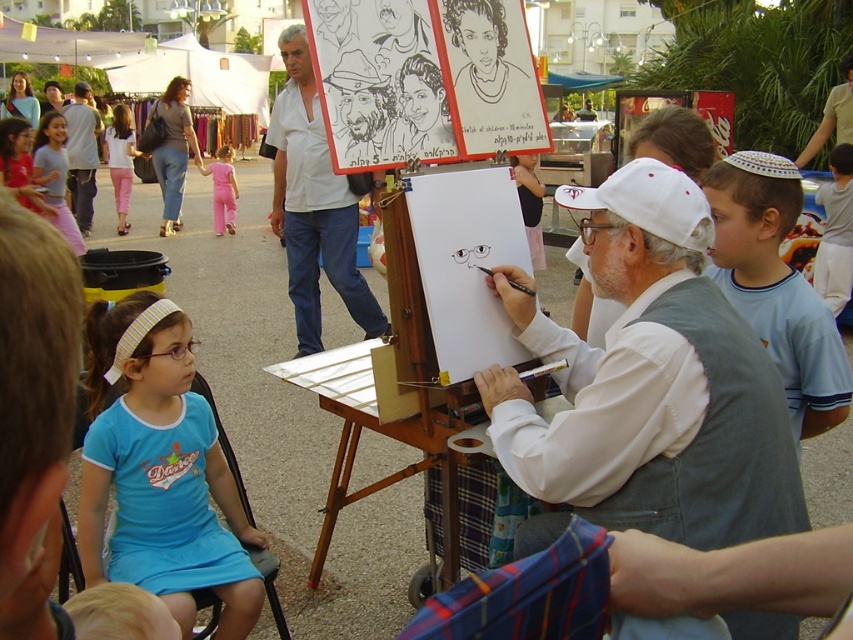
Between light blue t-shirt at right and matte white shirt at upper center, which one appears on the right side from the viewer's perspective?

light blue t-shirt at right

Can you confirm if light blue t-shirt at right is taller than matte white shirt at upper center?

No, light blue t-shirt at right is not taller than matte white shirt at upper center.

Where is `light blue t-shirt at right`? light blue t-shirt at right is located at coordinates (776, 284).

Find the location of a particular element. light blue t-shirt at right is located at coordinates (776, 284).

Is light blue t-shirt at right further to camera compared to white cotton shirt at upper right?

No.

This screenshot has width=853, height=640. Find the location of `light blue t-shirt at right`. light blue t-shirt at right is located at coordinates (776, 284).

The height and width of the screenshot is (640, 853). I want to click on light blue t-shirt at right, so click(776, 284).

Which is in front, point (775, 388) or point (462, 566)?

Point (775, 388)

This screenshot has width=853, height=640. Describe the element at coordinates (651, 381) in the screenshot. I see `white fabric vest at center` at that location.

What do you see at coordinates (651, 381) in the screenshot? The width and height of the screenshot is (853, 640). I see `white fabric vest at center` at bounding box center [651, 381].

What are the coordinates of `white fabric vest at center` in the screenshot? It's located at (651, 381).